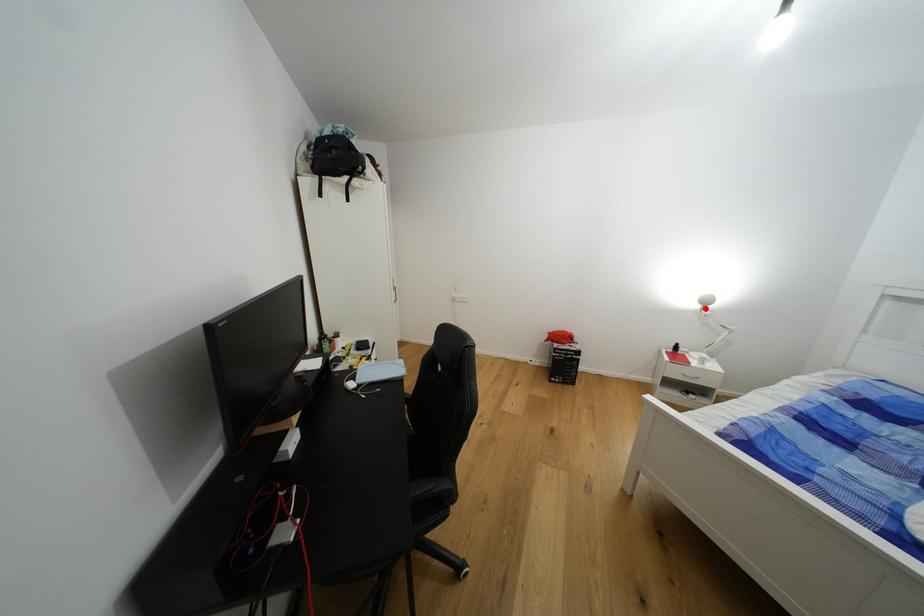
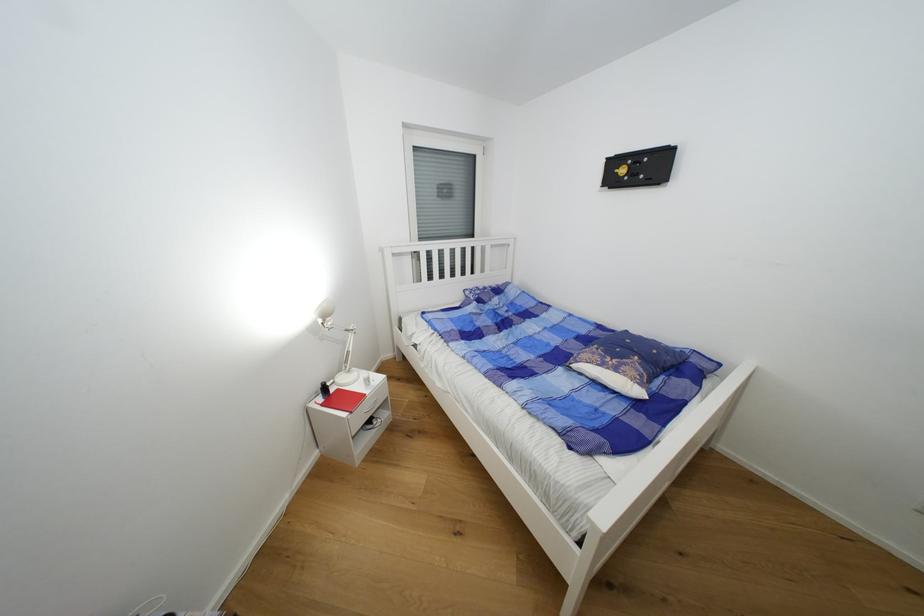
Find the pixel in the second image that matches the highlighted location in the first image.

(325, 323)